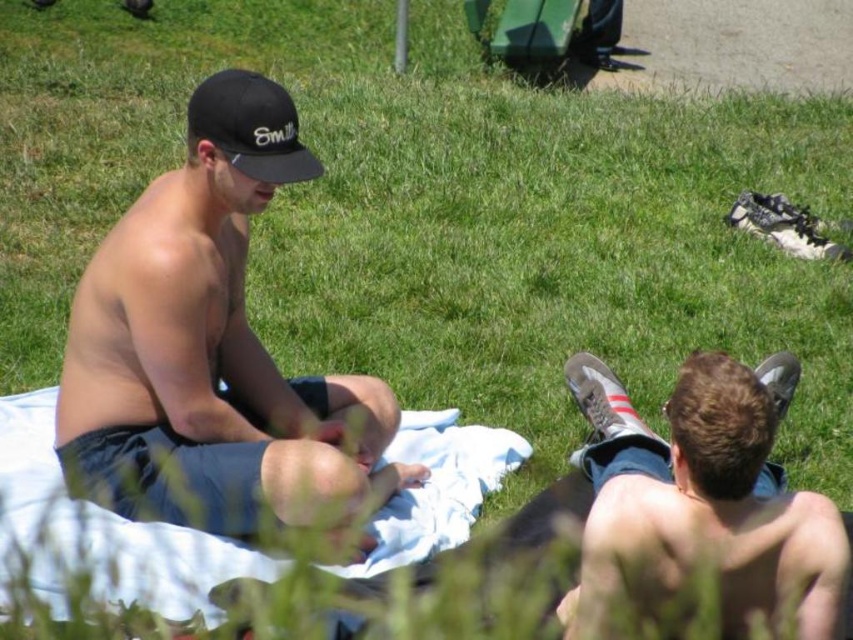
Does matte black cap at upper left have a smaller size compared to black matte baseball cap at upper left?

Incorrect, matte black cap at upper left is not smaller in size than black matte baseball cap at upper left.

Who is positioned more to the left, matte black cap at upper left or black matte baseball cap at upper left?

black matte baseball cap at upper left

Where is `matte black cap at upper left`? This screenshot has height=640, width=853. matte black cap at upper left is located at coordinates (213, 349).

Locate an element on the screen. The width and height of the screenshot is (853, 640). matte black cap at upper left is located at coordinates (213, 349).

Who is positioned more to the right, white cloth at center or black matte baseball cap at upper left?

black matte baseball cap at upper left is more to the right.

Between white cloth at center and black matte baseball cap at upper left, which one is positioned higher?

black matte baseball cap at upper left is above.

Is point (146, 545) closer to camera compared to point (206, 81)?

That is False.

Identify the location of white cloth at center. (102, 532).

Which is more to the right, matte black cap at upper left or white cloth at center?

matte black cap at upper left

Who is positioned more to the left, matte black cap at upper left or white cloth at center?

Positioned to the left is white cloth at center.

In order to click on matte black cap at upper left in this screenshot , I will do `click(213, 349)`.